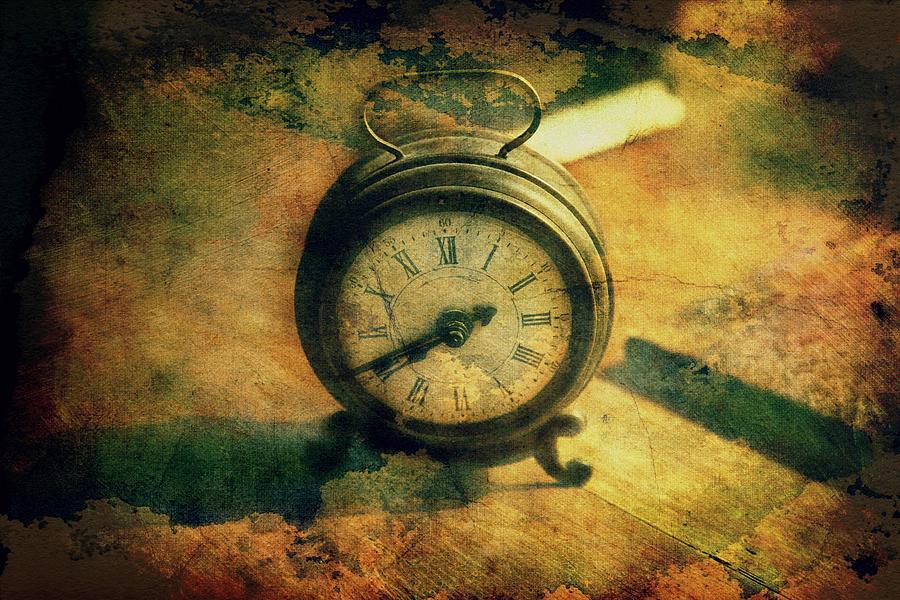
You are a GUI agent. You are given a task and a screenshot of the screen. Output one action in this format:
    pyautogui.click(x=<x>, y=<y>)
    Task: Click on the dark diagonal inlay section of brown wooden table, lower right corner
    
    Given the screenshot: What is the action you would take?
    pyautogui.click(x=675, y=377), pyautogui.click(x=769, y=419), pyautogui.click(x=826, y=451)